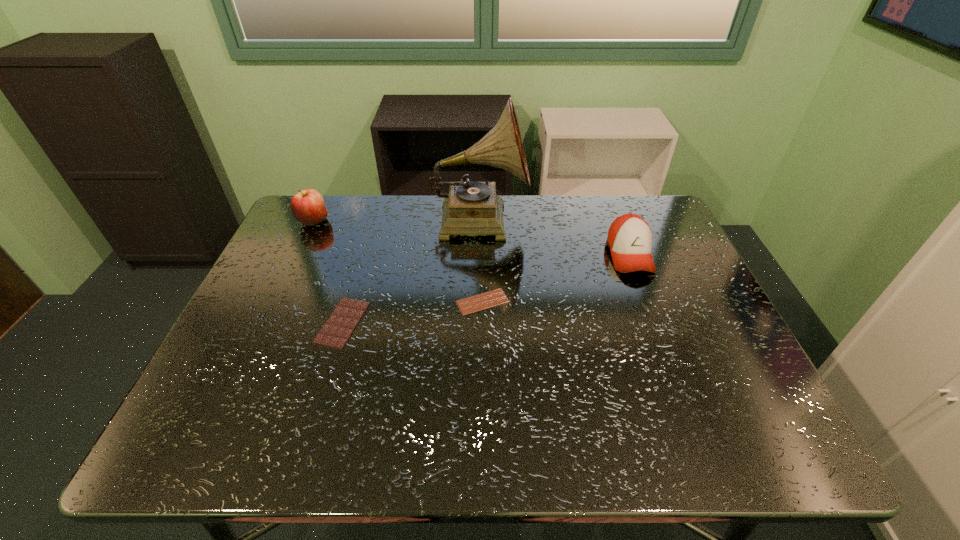
Identify the location of free space between the apple and the left chocolate bar. (328, 272).

The height and width of the screenshot is (540, 960). What are the coordinates of `free space that is in between the shorter chocolate bar and the rightmost object` in the screenshot? It's located at (556, 278).

Identify the location of free space between the tallest object and the fourth tallest object. The image size is (960, 540). (411, 271).

Image resolution: width=960 pixels, height=540 pixels. Find the location of `free point between the fourth tallest object and the shorter chocolate bar`. free point between the fourth tallest object and the shorter chocolate bar is located at coordinates (413, 312).

The image size is (960, 540). I want to click on free spot between the record player and the apple, so click(x=396, y=220).

At what (x,y) coordinates should I click in order to perform the action: click on empty space that is in between the tallest object and the taller chocolate bar. Please return your answer as a coordinate pair (x, y). This screenshot has height=540, width=960. Looking at the image, I should click on (411, 271).

Identify which object is the second nearest to the apple. Please provide its 2D coordinates. Your answer should be formatted as a tuple, i.e. [(x, y)], where the tuple contains the x and y coordinates of a point satisfying the conditions above.

[(471, 208)]

The height and width of the screenshot is (540, 960). Identify the location of the closest object to the second object from left to right. (496, 297).

Identify the location of free space that satisfies the following two spatial constraints: 1. from the horn of the record player; 2. on the back side of the right chocolate bar. The image size is (960, 540). (479, 302).

At what (x,y) coordinates should I click in order to perform the action: click on free point that satisfies the following two spatial constraints: 1. from the horn of the shortest object; 2. on the left side of the tallest object. Please return your answer as a coordinate pair (x, y). Image resolution: width=960 pixels, height=540 pixels. Looking at the image, I should click on (479, 302).